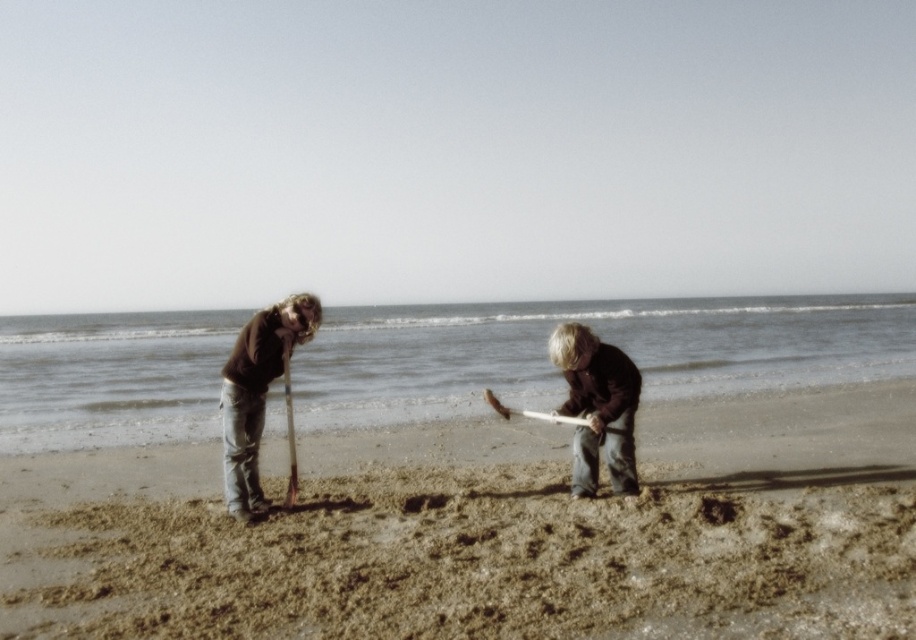
Is wooden stick at center closer to the viewer compared to matte brown sweater at left?

Yes, wooden stick at center is closer to the viewer.

Who is positioned more to the left, wooden stick at center or matte brown sweater at left?

From the viewer's perspective, matte brown sweater at left appears more on the left side.

At what (x,y) coordinates should I click in order to perform the action: click on wooden stick at center. Please return your answer as a coordinate pair (x, y). The height and width of the screenshot is (640, 916). Looking at the image, I should click on (597, 406).

Find the location of a particular element. This screenshot has width=916, height=640. wooden stick at center is located at coordinates (597, 406).

Is brown sandy beach at center above matte brown sweater at left?

No, brown sandy beach at center is not above matte brown sweater at left.

Between brown sandy beach at center and matte brown sweater at left, which one is positioned lower?

Positioned lower is brown sandy beach at center.

What do you see at coordinates (489, 563) in the screenshot?
I see `brown sandy beach at center` at bounding box center [489, 563].

Where is `brown sandy beach at center`? This screenshot has height=640, width=916. brown sandy beach at center is located at coordinates (489, 563).

Is brown sandy beach at center below wooden stick at center?

Indeed, brown sandy beach at center is positioned under wooden stick at center.

At what (x,y) coordinates should I click in order to perform the action: click on brown sandy beach at center. Please return your answer as a coordinate pair (x, y). Looking at the image, I should click on (489, 563).

Is point (642, 500) positioned after point (594, 381)?

Yes, point (642, 500) is behind point (594, 381).

Find the location of a particular element. This screenshot has width=916, height=640. brown sandy beach at center is located at coordinates (489, 563).